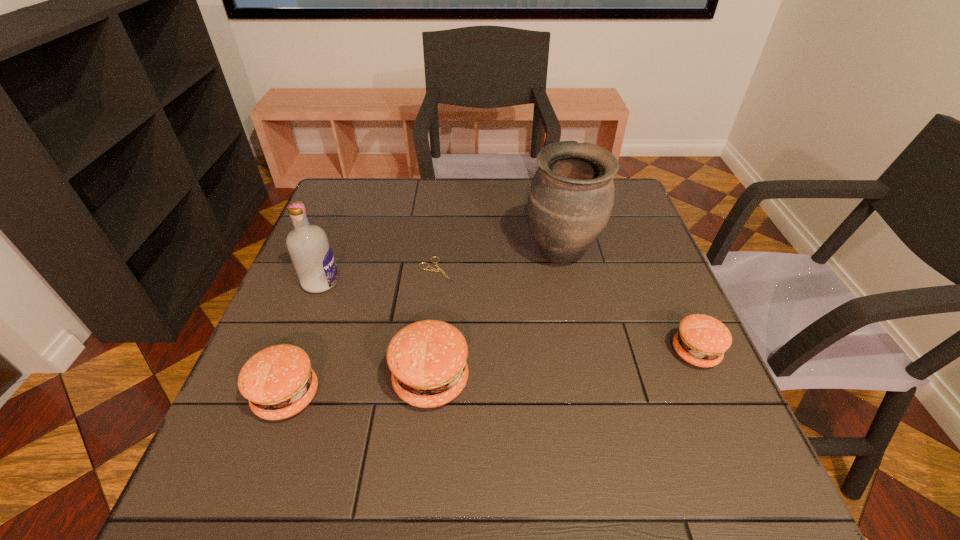
I want to click on free space that is in between the shears and the fifth shortest object, so click(379, 276).

This screenshot has width=960, height=540. I want to click on blank region between the fifth shortest object and the fourth tallest object, so click(x=304, y=339).

The height and width of the screenshot is (540, 960). I want to click on vacant space that's between the second object from right to left and the fifth tallest object, so click(x=629, y=303).

Identify the location of free point between the shortest object and the fifth shortest object. (379, 276).

The width and height of the screenshot is (960, 540). I want to click on free space that is in between the leftmost patty and the shortest object, so click(362, 333).

Identify the location of object that is the fourth nearest to the rightmost patty. The width and height of the screenshot is (960, 540). (278, 381).

Select which object is the fourth closest to the third shortest object. Please provide its 2D coordinates. Your answer should be formatted as a tuple, i.e. [(x, y)], where the tuple contains the x and y coordinates of a point satisfying the conditions above.

[(570, 200)]

Locate an element on the screen. This screenshot has height=540, width=960. patty object that ranks as the third closest to the tallest object is located at coordinates (278, 381).

This screenshot has height=540, width=960. Find the location of `the second closest patty to the second shortest patty`. the second closest patty to the second shortest patty is located at coordinates (701, 340).

Find the location of `free space in the image that satisfies the following two spatial constraints: 1. on the label of the tallest patty; 2. on the left side of the fifth shortest object`. free space in the image that satisfies the following two spatial constraints: 1. on the label of the tallest patty; 2. on the left side of the fifth shortest object is located at coordinates (283, 381).